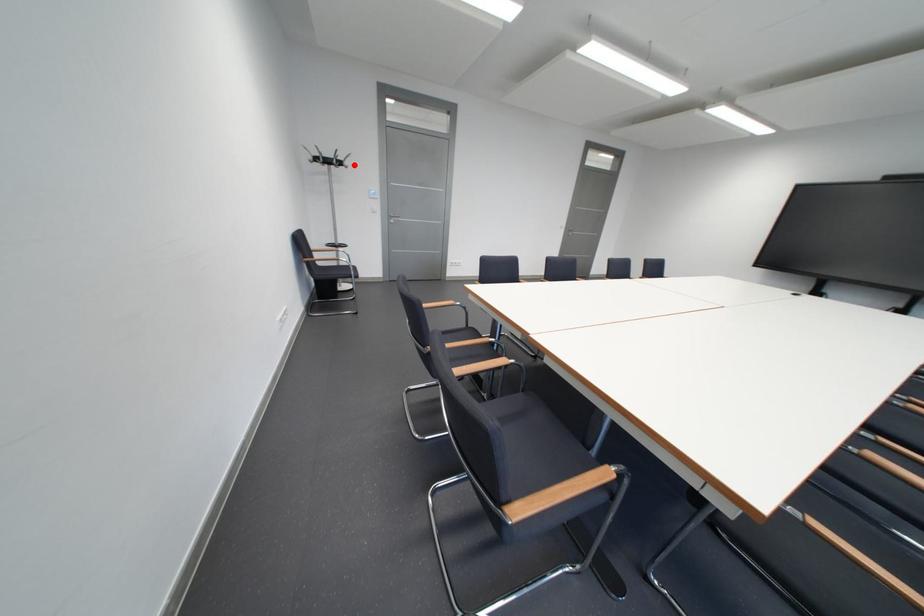
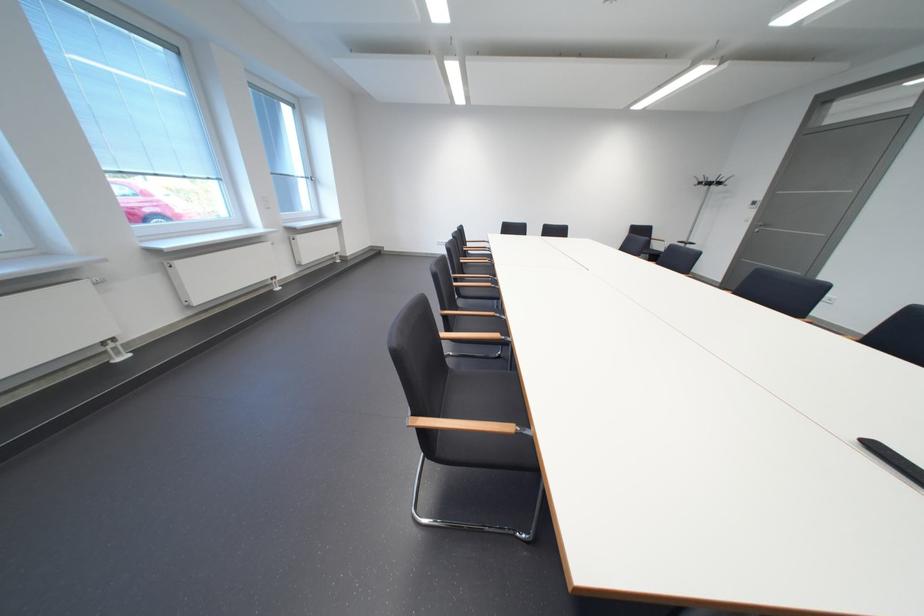
In the second image, find the point that corresponds to the highlighted location in the first image.

(723, 185)